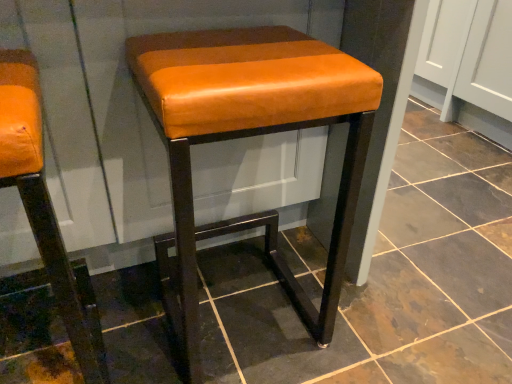
You are a GUI agent. You are given a task and a screenshot of the screen. Output one action in this format:
    pyautogui.click(x=<x>, y=<y>)
    Task: Click on the vacant space that is to the left of matte orange leather stool at center, marked as the first stool in a right-to-left arrangement
    
    Given the screenshot: What is the action you would take?
    pyautogui.click(x=128, y=312)